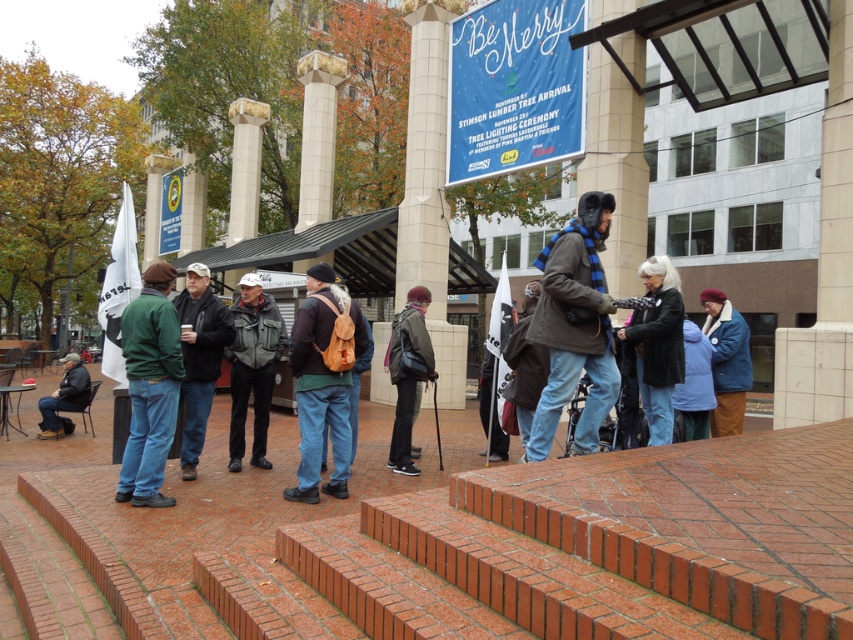
Between green matte jacket at center and dark gray backpack at center, which one has less height?

dark gray backpack at center is shorter.

In the scene shown: Who is more distant from viewer, (151,301) or (392,442)?

The point (392,442) is behind.

This screenshot has height=640, width=853. I want to click on green matte jacket at center, so click(149, 387).

Who is positioned more to the right, brown leather jacket at center or dark brown leather jacket at center?

brown leather jacket at center

Is brown leather jacket at center wider than dark brown leather jacket at center?

Correct, the width of brown leather jacket at center exceeds that of dark brown leather jacket at center.

Who is more forward, (595,401) or (544,360)?

Point (595,401) is more forward.

This screenshot has height=640, width=853. I want to click on brown leather jacket at center, so click(573, 326).

Does point (137, 410) lie in front of point (77, 392)?

Yes, point (137, 410) is in front of point (77, 392).

Where is `green matte jacket at center`? The height and width of the screenshot is (640, 853). green matte jacket at center is located at coordinates (149, 387).